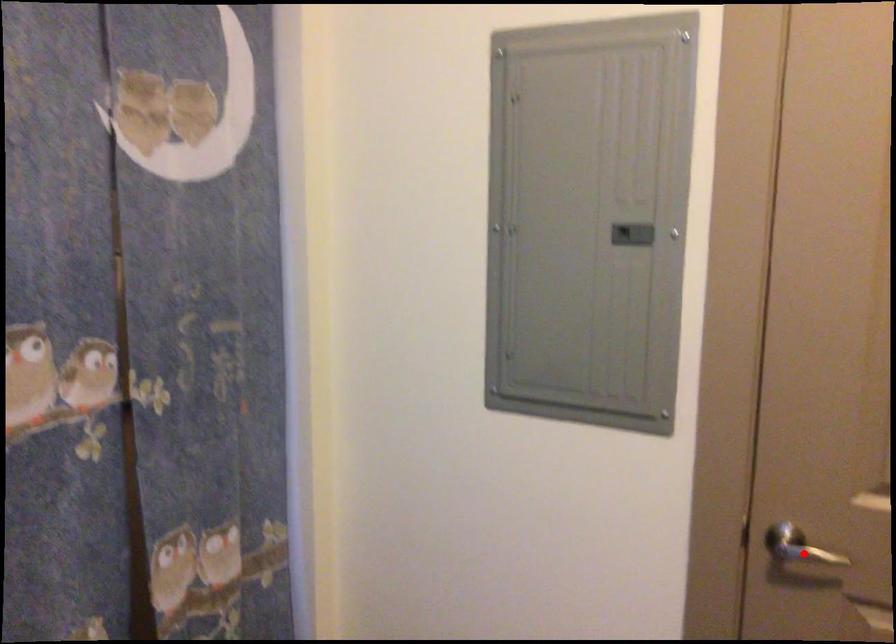
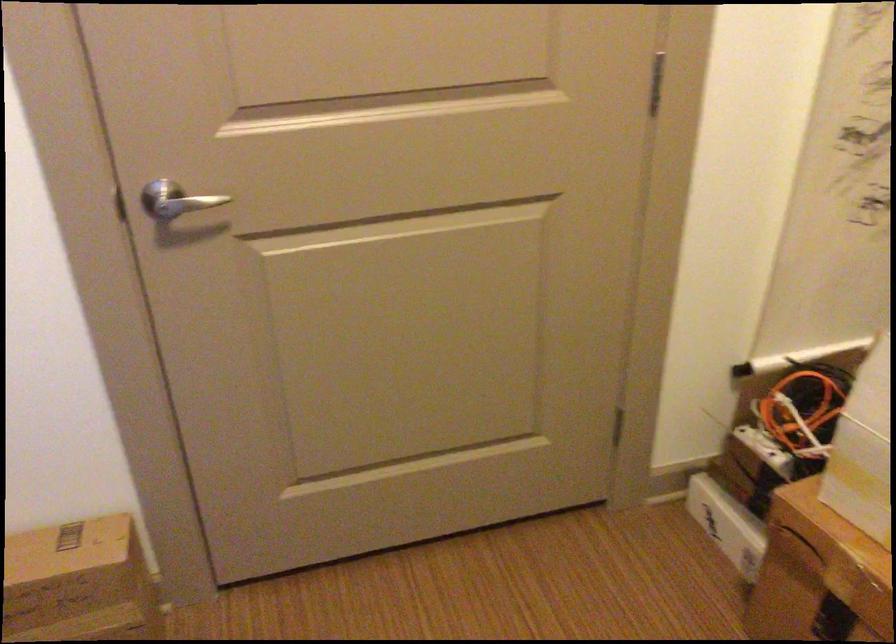
The point at the highlighted location is marked in the first image. Where is the corresponding point in the second image?

(176, 200)